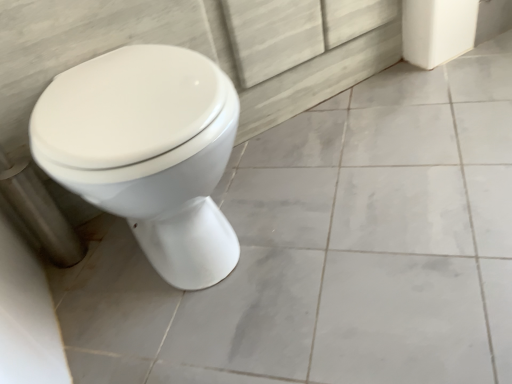
The width and height of the screenshot is (512, 384). I want to click on free space to the left of white glossy toilet at left, so click(x=92, y=285).